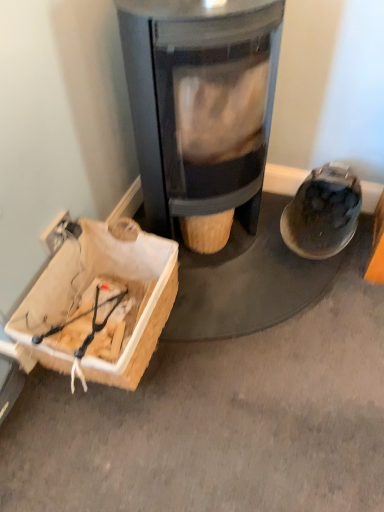
The width and height of the screenshot is (384, 512). I want to click on vacant space that is in between matte black wood burning stove at center and matte black shoe at right, so click(291, 273).